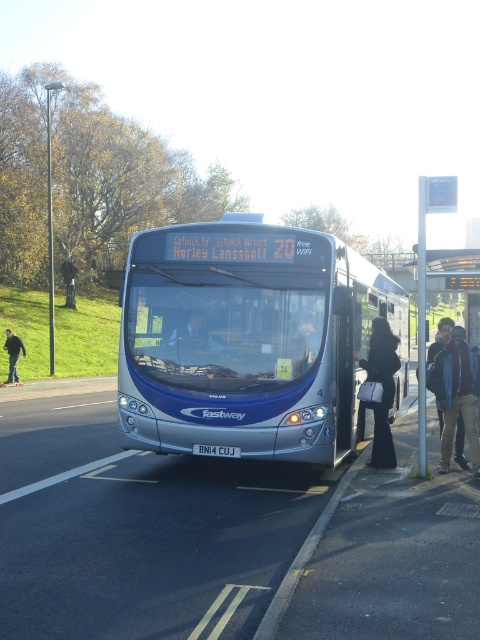
Question: Does blue denim jacket at center appear on the left side of matte blue bus at center?

Choices:
 (A) yes
 (B) no

Answer: (B)

Question: Can you confirm if blue denim jacket at center is positioned below dark blue jeans at lower left?

Choices:
 (A) yes
 (B) no

Answer: (A)

Question: Is matte blue bus at center to the right of dark blue jeans at lower left from the viewer's perspective?

Choices:
 (A) yes
 (B) no

Answer: (A)

Question: Which point is closer to the camera?

Choices:
 (A) silver metallic bus at center
 (B) dark blue jeans at lower left
 (C) black leather handbag at center
 (D) matte blue bus at center

Answer: (A)

Question: Among these points, which one is nearest to the camera?

Choices:
 (A) (381, 339)
 (B) (448, 380)
 (C) (321, 356)

Answer: (C)

Question: Which of the following is the closest to the observer?

Choices:
 (A) (471, 353)
 (B) (242, 232)
 (C) (386, 452)

Answer: (B)